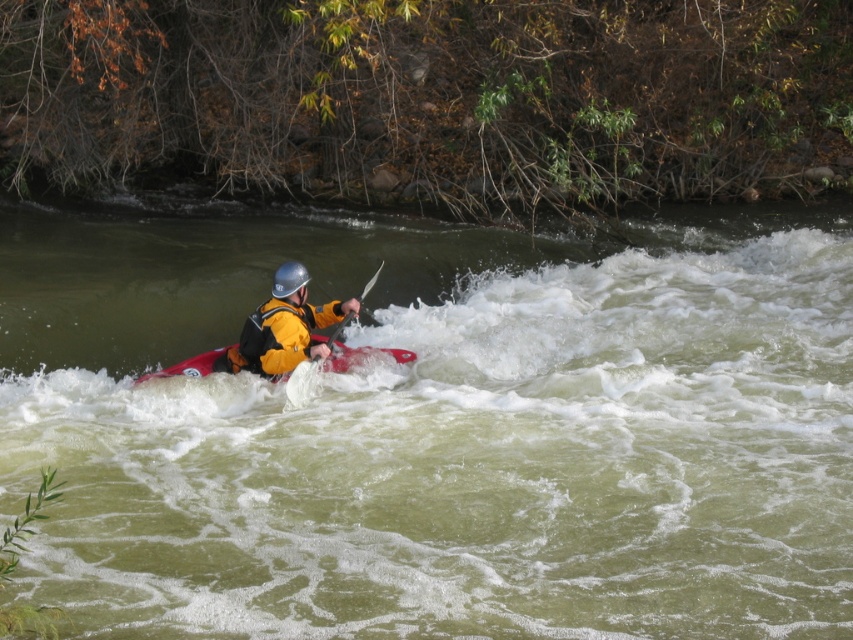
You are a photographer trying to capture the kayaker in the middle of the rapids. You notice the yellow matte life jacket at center and the matte black paddle at center. Which object should you focus on first if you want to capture the kayaker from the left side?

The yellow matte life jacket at center is to the left of the matte black paddle at center, so focusing on the yellow matte life jacket at center first would help capture the kayaker from the left side.

Based on the photo, you are a photographer trying to capture the kayaker in the rapids. You notice the yellow matte life jacket at center and the matte black paddle at center. Which object should you focus on if you want to ensure the subject with the larger width is in the frame?

The yellow matte life jacket at center has a larger width than the matte black paddle at center, so focusing on the yellow matte life jacket at center will ensure the wider object is captured in the frame.

You are a photographer trying to capture the kayaker in action. You notice the yellow matte life jacket at center and the matte black paddle at center. Which object should you focus on first if you want to ensure both are in sharp focus, considering their positions?

The yellow matte life jacket at center should be focused on first since the matte black paddle at center is behind it, ensuring both will be in focus by focusing on the front object.